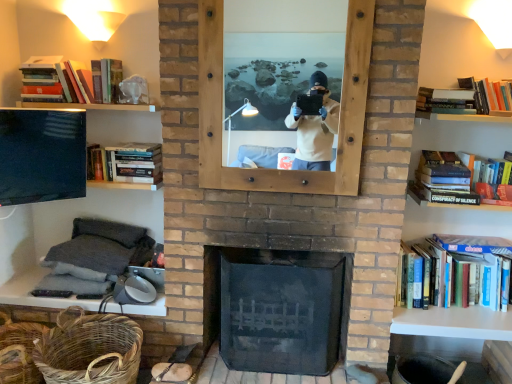
Question: Based on their positions, is woven natural basket at lower left, the first basket positioned from the left, located to the left or right of wooden mirror at center?

Choices:
 (A) right
 (B) left

Answer: (B)

Question: From the image's perspective, is woven natural basket at lower left, the second basket positioned from the right, positioned above or below wooden mirror at center?

Choices:
 (A) below
 (B) above

Answer: (A)

Question: Based on their relative distances, which object is farther from the white matte shelf at right, which ranks as the first mantle in right-to-left order?

Choices:
 (A) black glass fireplace at center
 (B) hardcover book at left, the third book from the bottom
 (C) hardcover book at upper right, the fourth book ordered from the bottom
 (D) hardcover book at right, which appears as the fifth book when viewed from the top
 (E) woven brown basket at lower left, the first basket from the right

Answer: (B)

Question: Which object is positioned closest to the gray fabric pillow at lower left, marked as the first mantle in a left-to-right arrangement?

Choices:
 (A) wooden mirror at center
 (B) white matte shelf at right, which ranks as the first mantle in right-to-left order
 (C) woven brown basket at lower left, the 2th basket in the left-to-right sequence
 (D) black glass fireplace at center
 (E) hardcover book at right, which appears as the third book when viewed from the right

Answer: (C)